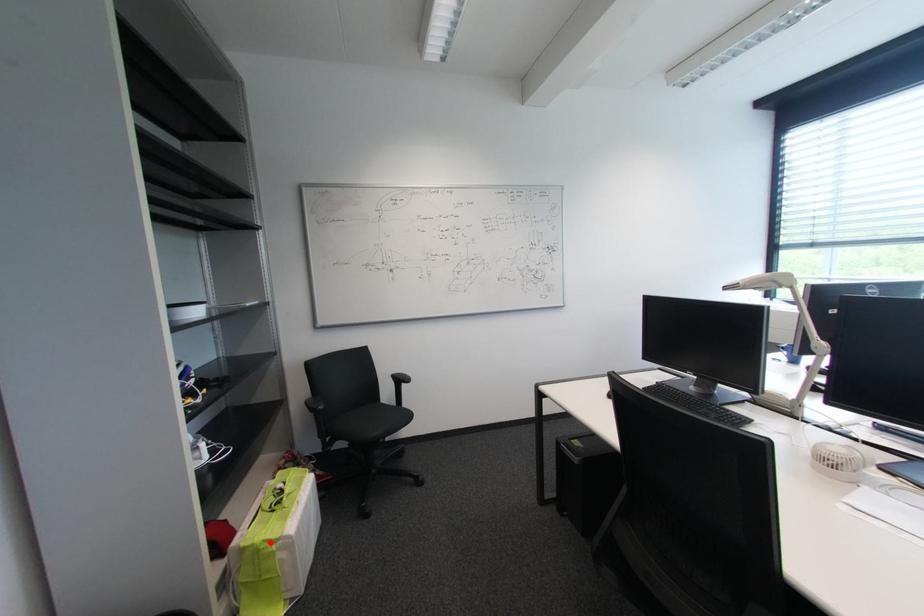
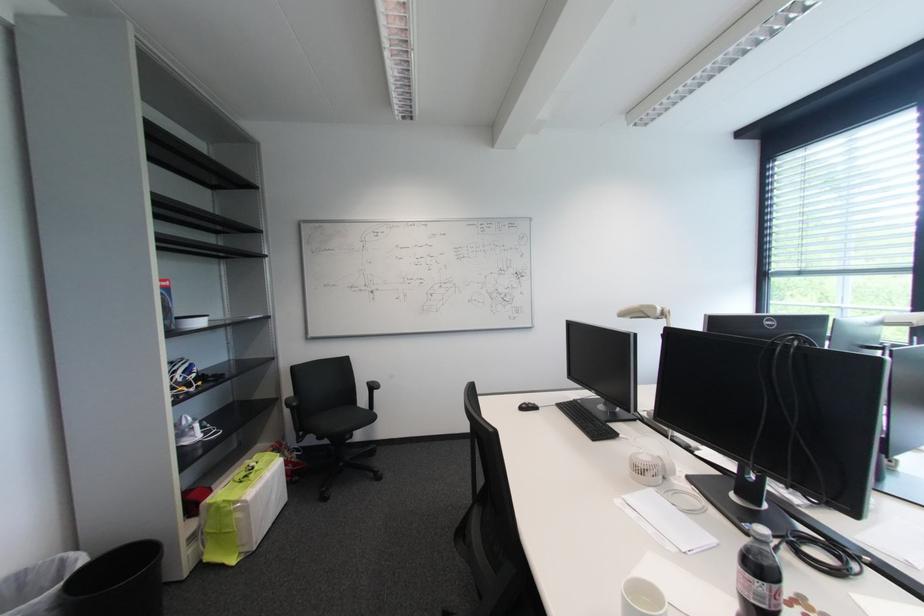
In the second image, find the point that corresponds to the highlighted location in the first image.

(231, 503)